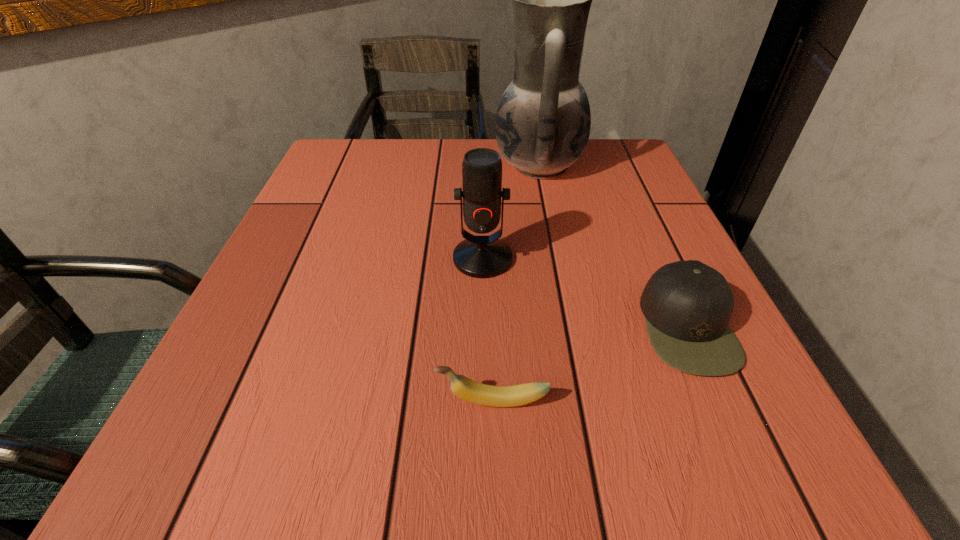
The width and height of the screenshot is (960, 540). I want to click on free space between the second nearest object and the microphone, so click(x=585, y=293).

The width and height of the screenshot is (960, 540). I want to click on free spot between the shortest object and the rightmost object, so click(x=590, y=364).

Where is `empty location between the third nearest object and the tallest object`? The image size is (960, 540). empty location between the third nearest object and the tallest object is located at coordinates (511, 212).

At what (x,y) coordinates should I click in order to perform the action: click on vacant space that's between the third farthest object and the shortest object. Please return your answer as a coordinate pair (x, y). Looking at the image, I should click on (590, 364).

At what (x,y) coordinates should I click in order to perform the action: click on free space that is in between the nearest object and the microphone. Please return your answer as a coordinate pair (x, y). The height and width of the screenshot is (540, 960). Looking at the image, I should click on (488, 330).

Locate an element on the screen. This screenshot has height=540, width=960. vacant area between the tallest object and the second shortest object is located at coordinates (612, 246).

You are a GUI agent. You are given a task and a screenshot of the screen. Output one action in this format:
    pyautogui.click(x=<x>, y=<y>)
    Task: Click on the free space between the shortest object and the rightmost object
    The height and width of the screenshot is (540, 960).
    Given the screenshot: What is the action you would take?
    pyautogui.click(x=590, y=364)

Identify the location of object that is the closest to the shortest object. The height and width of the screenshot is (540, 960). (687, 305).

Identify which object is the second nearest to the shortest object. Please provide its 2D coordinates. Your answer should be formatted as a tuple, i.e. [(x, y)], where the tuple contains the x and y coordinates of a point satisfying the conditions above.

[(477, 256)]

Where is `vacant region that satisfies the following two spatial constraints: 1. on the front-facing side of the pitcher; 2. on the side of the third nearest object with the red ring`? This screenshot has height=540, width=960. vacant region that satisfies the following two spatial constraints: 1. on the front-facing side of the pitcher; 2. on the side of the third nearest object with the red ring is located at coordinates (557, 259).